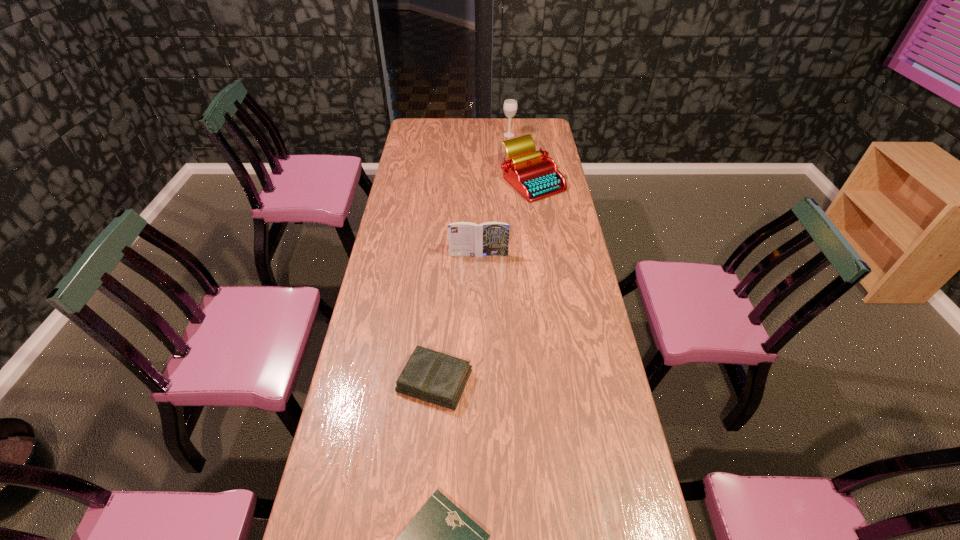
Identify the location of the tallest object. (510, 105).

The image size is (960, 540). Identify the location of wineglass. (510, 105).

The width and height of the screenshot is (960, 540). I want to click on the tallest book, so click(x=465, y=238).

You are a GUI agent. You are given a task and a screenshot of the screen. Output one action in this format:
    pyautogui.click(x=<x>, y=<y>)
    Task: Click on the third farthest object
    
    Given the screenshot: What is the action you would take?
    pyautogui.click(x=465, y=238)

At what (x,y) coordinates should I click in order to perform the action: click on typewriter. Please return your answer as a coordinate pair (x, y). The image size is (960, 540). Looking at the image, I should click on (533, 174).

This screenshot has height=540, width=960. In order to click on the fourth farthest object in this screenshot , I will do `click(434, 377)`.

Locate an element on the screen. This screenshot has height=540, width=960. the second farthest book is located at coordinates 434,377.

I want to click on free space located on the back of the tallest object, so click(x=508, y=123).

Image resolution: width=960 pixels, height=540 pixels. In order to click on vacant area situated 0.280m on the front cover of the farthest book in this screenshot , I will do `click(478, 313)`.

Identify the location of vacant space located 0.130m on the typing side of the typewriter. (539, 221).